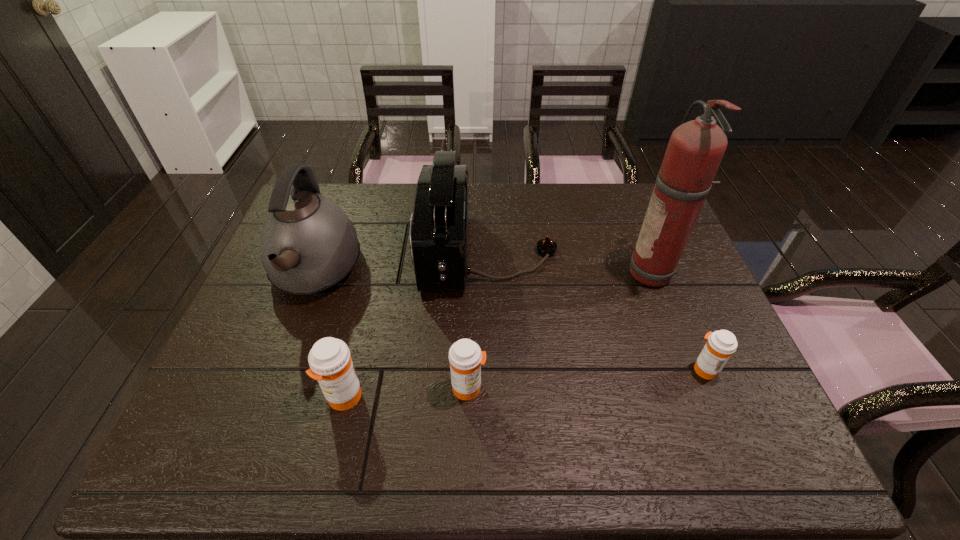
Identify the location of vacant area situated on the left of the rightmost medicine. This screenshot has width=960, height=540. (544, 369).

Where is `free spot located on the front-facing side of the radio receiver`? The width and height of the screenshot is (960, 540). free spot located on the front-facing side of the radio receiver is located at coordinates (334, 253).

Where is `blank space located on the front-facing side of the radio receiver`? The image size is (960, 540). blank space located on the front-facing side of the radio receiver is located at coordinates (334, 253).

Find the location of a particular element. The image size is (960, 540). vacant space situated 0.090m on the front-facing side of the radio receiver is located at coordinates (389, 253).

The image size is (960, 540). In order to click on vacant space located at the spout of the kettle in this screenshot , I will do (274, 384).

Where is `vacant region located on the side of the tallest object with the label and nozzle`? vacant region located on the side of the tallest object with the label and nozzle is located at coordinates (589, 274).

Where is `vacant space located 0.060m on the side of the tallest object with the label and nozzle`? This screenshot has width=960, height=540. vacant space located 0.060m on the side of the tallest object with the label and nozzle is located at coordinates (607, 274).

Image resolution: width=960 pixels, height=540 pixels. I want to click on free space located on the side of the tallest object with the label and nozzle, so click(x=496, y=274).

This screenshot has height=540, width=960. What are the coordinates of `object that is at the far edge` in the screenshot? It's located at (439, 226).

Identify the location of object located at the left edge. (309, 245).